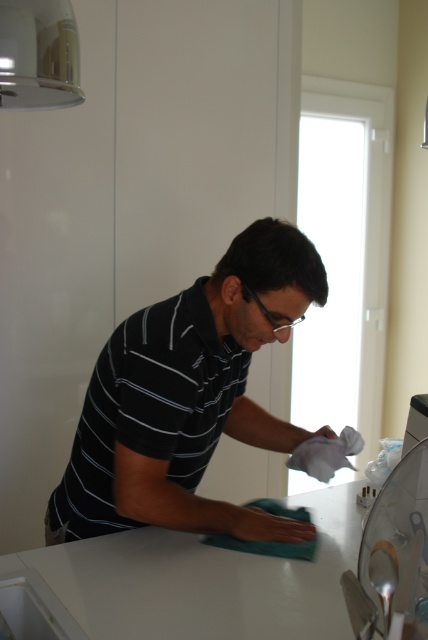
You are a robot observing a man in a kitchen. The man is wearing a black striped shirt at center. There is a point at coordinates point (189, 397). Is this point located on the man?

Yes, the point (189, 397) is on the black striped shirt at center, which the man is wearing, so it is located on the man.

In the scene shown: You are a fashion designer observing a man in a kitchen. You notice the black striped shirt at center and the white glossy counter top at center. Which object is narrower?

The black striped shirt at center is narrower than the white glossy counter top at center.

From the picture: You are a home inspector assessing the kitchen layout. You notice the black striped shirt at center and the white glossy counter top at center. Based on their positions, which object is closer to the ceiling?

The black striped shirt at center is much taller than the white glossy counter top at center, so the black striped shirt at center is closer to the ceiling.